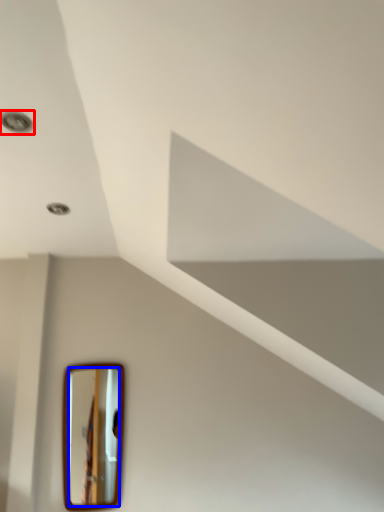
Question: Among these objects, which one is nearest to the camera, droplight (highlighted by a red box) or mirror (highlighted by a blue box)?

Choices:
 (A) droplight
 (B) mirror

Answer: (A)